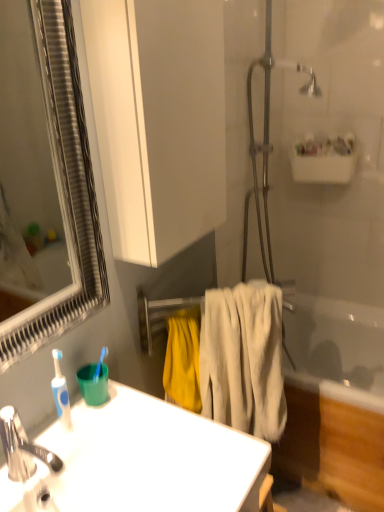
The width and height of the screenshot is (384, 512). I want to click on free point behind polished chrome faucet at lower left, so click(x=74, y=429).